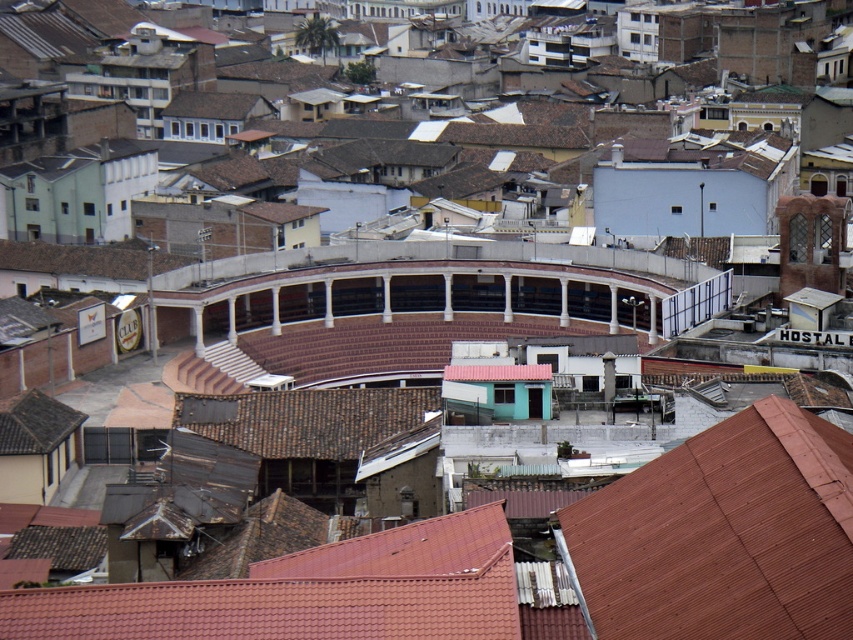
You are standing at the arena with red seating enclosed by white columns in the foreground. You need to locate the brown tile roof at center. According to the coordinates provided, where exactly is it positioned?

The brown tile roof at center is located at point (x=723, y=534), which means it is positioned towards the upper right section of the image based on standard coordinate systems where the origin is the bottom left corner.

You are standing in the urban landscape scene described. You notice two points marked in the image. The first point is at coordinates point (30, 596) and the second is at point (619, 605). Which point is closer to your viewpoint?

Point (30, 596) is further to the camera than point (619, 605), so the point closer to your viewpoint is point (619, 605).